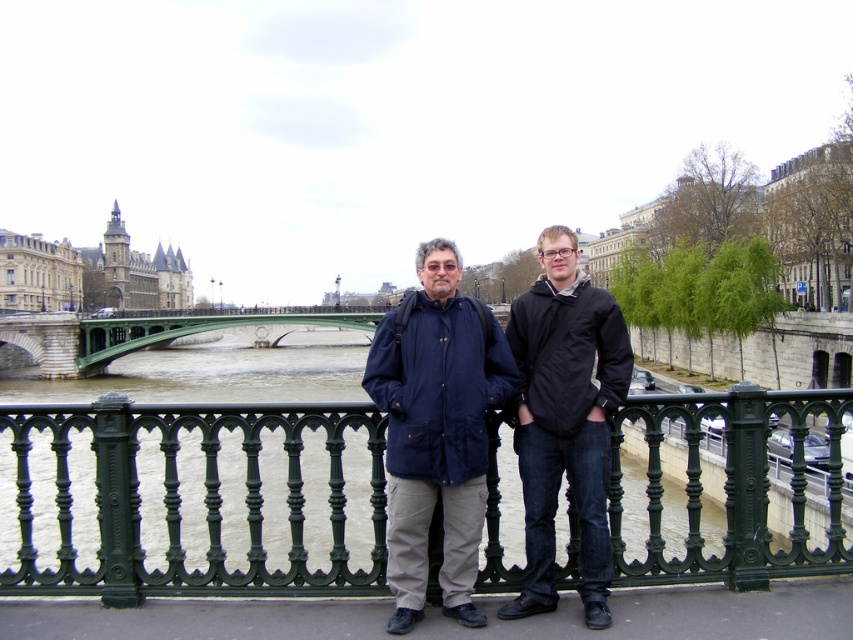
Question: Which of the following is the closest to the observer?

Choices:
 (A) (548, 236)
 (B) (838, 493)
 (C) (32, 284)
 (D) (547, 403)

Answer: (D)

Question: Considering the relative positions of green stone bridge at center and dark gray stone tower at upper left in the image provided, where is green stone bridge at center located with respect to dark gray stone tower at upper left?

Choices:
 (A) below
 (B) above

Answer: (A)

Question: Where is matte blue jacket at center located in relation to dark gray stone tower at upper left in the image?

Choices:
 (A) right
 (B) left

Answer: (A)

Question: Which of the following is the closest to the observer?

Choices:
 (A) (120, 257)
 (B) (531, 480)
 (C) (242, 416)

Answer: (C)

Question: Is green wrought iron railing at center bigger than green stone bridge at center?

Choices:
 (A) yes
 (B) no

Answer: (B)

Question: Which object is farther from the camera taking this photo?

Choices:
 (A) stone gothic architecture at upper left
 (B) black matte jacket at center
 (C) dark gray stone tower at upper left
 (D) matte blue jacket at center

Answer: (C)